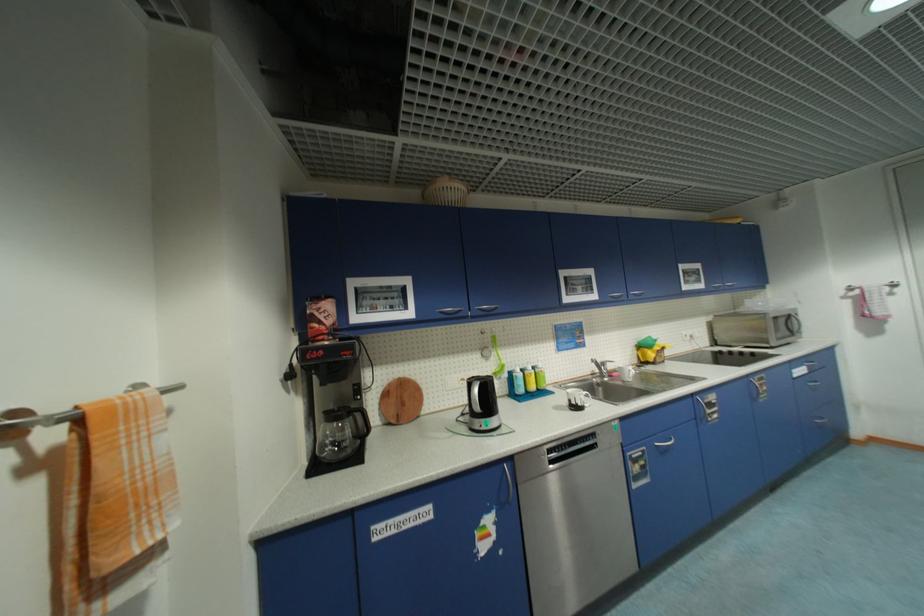
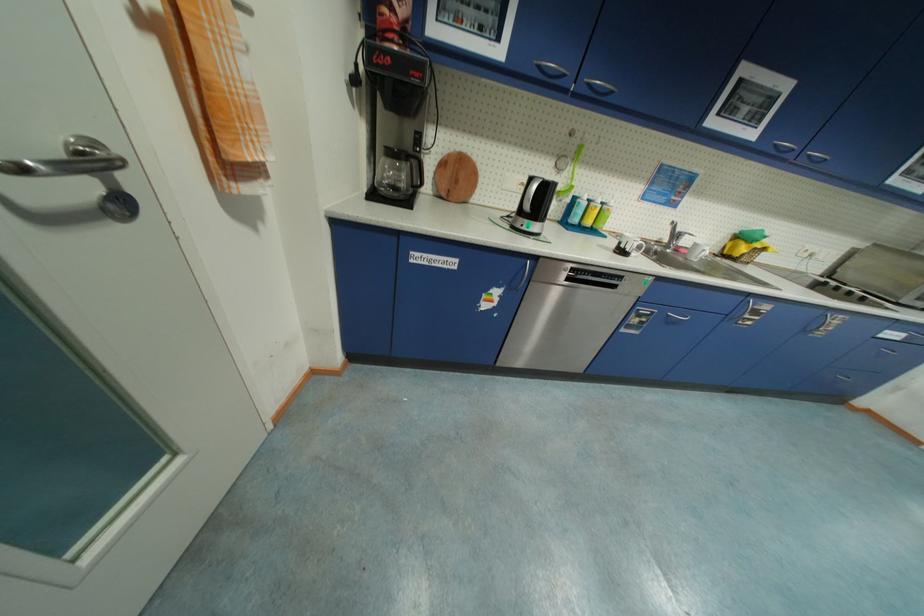
Locate, in the second image, the point that corresponds to point (447, 314) in the first image.

(544, 69)